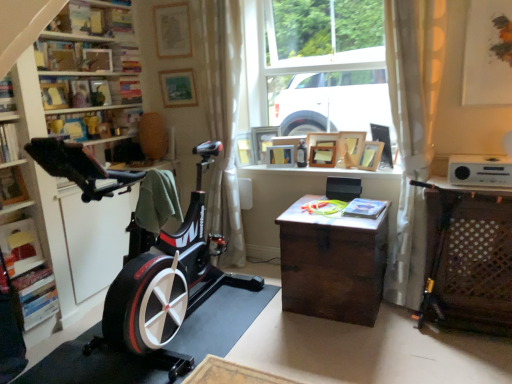
Locate an element on the screen. vacant space situated on the left part of wooden chest at center is located at coordinates (250, 308).